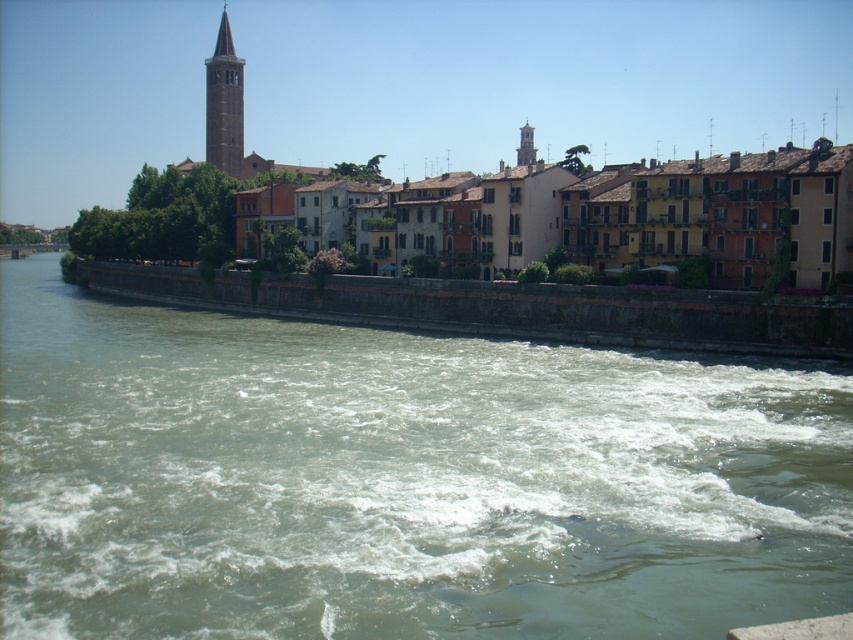
Can you confirm if greenish concrete river at center is taller than smooth beige bell tower at upper left?

No, greenish concrete river at center is not taller than smooth beige bell tower at upper left.

At what (x,y) coordinates should I click in order to perform the action: click on greenish concrete river at center. Please return your answer as a coordinate pair (x, y). The width and height of the screenshot is (853, 640). Looking at the image, I should click on (399, 481).

Is point (294, 436) closer to camera compared to point (210, 118)?

Yes, it is.

Locate an element on the screen. This screenshot has height=640, width=853. greenish concrete river at center is located at coordinates (399, 481).

Between multicolored stone buildings at center and smooth beige bell tower at upper left, which one has less height?

With less height is multicolored stone buildings at center.

Who is taller, multicolored stone buildings at center or smooth beige bell tower at upper left?

Standing taller between the two is smooth beige bell tower at upper left.

Is point (796, 157) positioned in front of point (209, 102)?

Yes, it is.

The width and height of the screenshot is (853, 640). I want to click on multicolored stone buildings at center, so click(x=602, y=216).

Is greenish concrete river at center positioned behind multicolored stone buildings at center?

No, it is in front of multicolored stone buildings at center.

Can you confirm if greenish concrete river at center is wider than multicolored stone buildings at center?

Yes, greenish concrete river at center is wider than multicolored stone buildings at center.

Who is more distant from viewer, (662, 451) or (846, 214)?

The point (846, 214) is more distant.

You are a GUI agent. You are given a task and a screenshot of the screen. Output one action in this format:
    pyautogui.click(x=<x>, y=<y>)
    Task: Click on the greenish concrete river at center
    
    Given the screenshot: What is the action you would take?
    pyautogui.click(x=399, y=481)